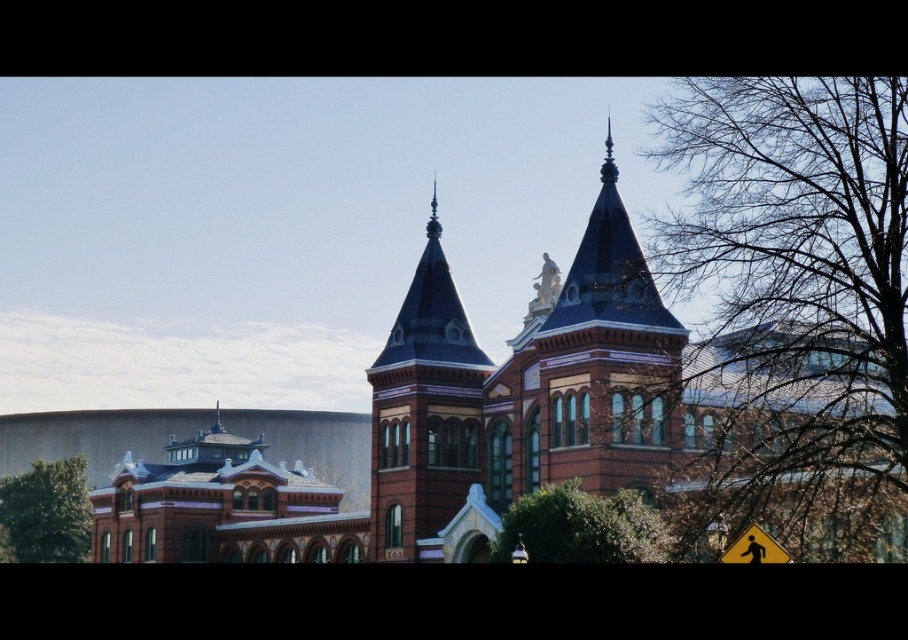
Question: Does bare branches at upper right appear on the left side of green leafy bush at lower center?

Choices:
 (A) yes
 (B) no

Answer: (B)

Question: Which of the following is the farthest from the observer?

Choices:
 (A) (33, 522)
 (B) (854, 186)
 (C) (768, 276)

Answer: (A)

Question: Can you confirm if brown brick church at center is positioned below yellow reflective plastic pedestrian crossing sign at lower right?

Choices:
 (A) yes
 (B) no

Answer: (B)

Question: Considering the real-world distances, which object is farthest from the green leafy tree at lower left?

Choices:
 (A) green leafy bush at lower center
 (B) brown brick church at center

Answer: (A)

Question: Among these objects, which one is farthest from the camera?

Choices:
 (A) shiny dark blue spire at center
 (B) bare branches at upper right
 (C) yellow reflective plastic pedestrian crossing sign at lower right
 (D) green leafy tree at lower left

Answer: (D)

Question: Can you confirm if bare branches at upper right is smaller than green leafy bush at lower center?

Choices:
 (A) no
 (B) yes

Answer: (A)